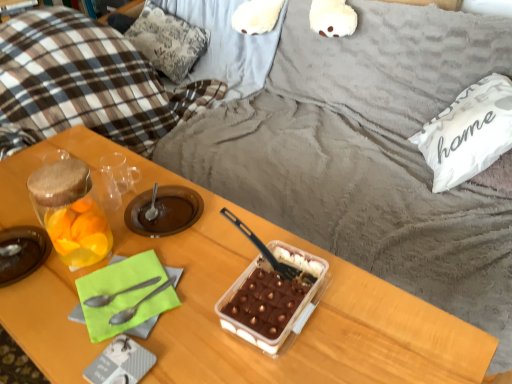
Find the location of `vacant space behind metallic silver spoon at lower left, acting as the first spoon starting from the left`. vacant space behind metallic silver spoon at lower left, acting as the first spoon starting from the left is located at coordinates (148, 238).